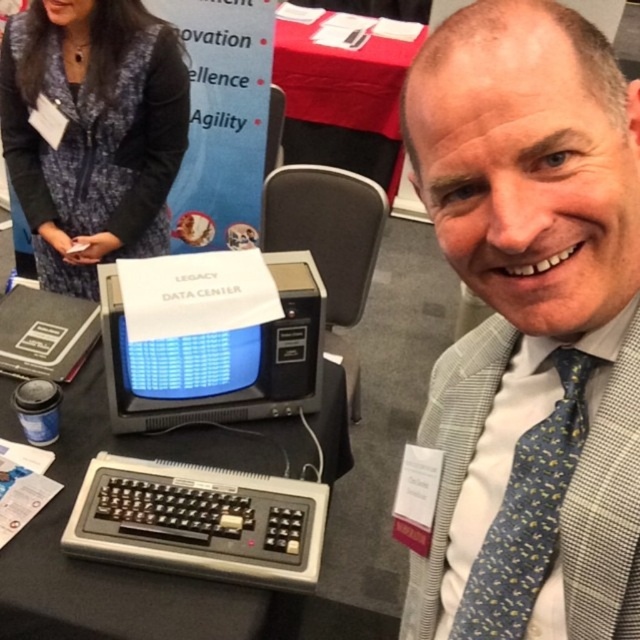
Looking at this image, you are a photographer at the exhibition and want to frame a shot that includes both the gray checkered suit at center and the black plastic keyboard at lower left. Which object should you place closer to the edges of the frame to ensure both fit within the shot?

Since the gray checkered suit at center is narrower than the black plastic keyboard at lower left, you should place the wider black plastic keyboard at lower left closer to the edges of the frame to ensure both fit within the shot.

You are a photographer at the exhibition and need to adjust the lighting so that the blue textured sweater at upper left and the black plastic crt monitor at center are both visible. Since the sweater is taller than the monitor, which object might cast a shadow over the other if the light is placed above them?

The blue textured sweater at upper left is taller than the black plastic crt monitor at center, so if the light is placed above them, the blue textured sweater at upper left would cast a shadow over the black plastic crt monitor at center.